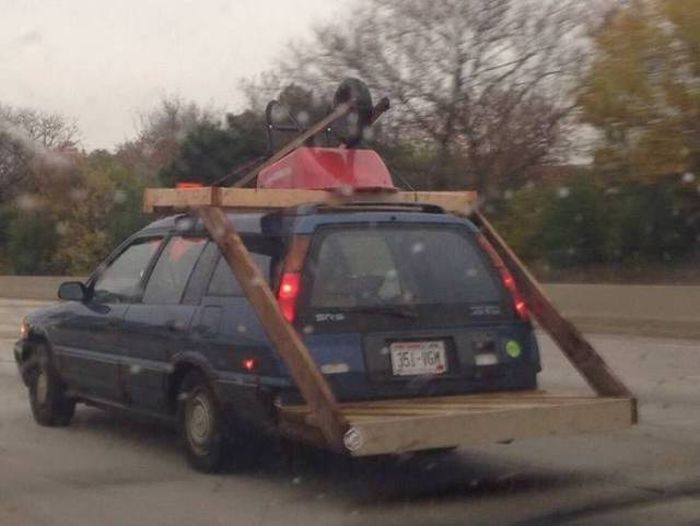
Where is `door`? The image size is (700, 526). door is located at coordinates (148, 326), (105, 320).